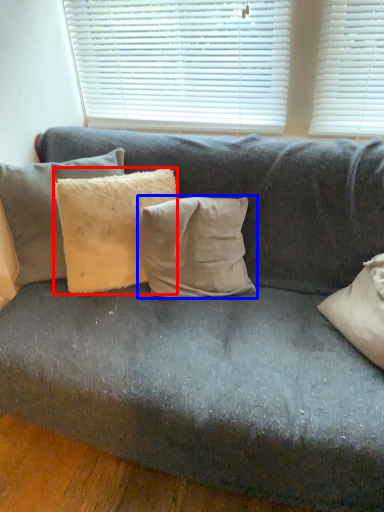
Question: Which point is closer to the camera, pillow (highlighted by a red box) or pillow (highlighted by a blue box)?

Choices:
 (A) pillow
 (B) pillow

Answer: (A)